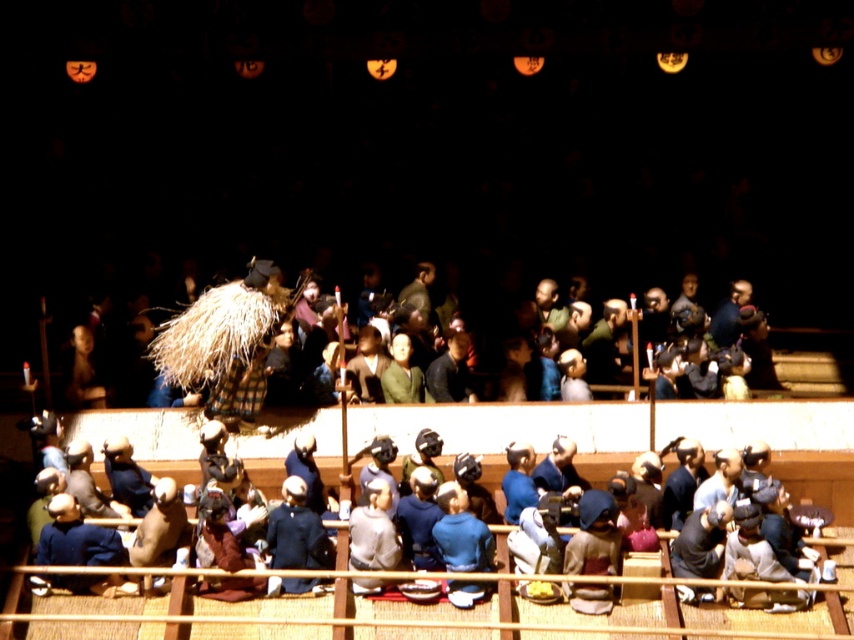
Question: Can you confirm if dark blue fabric at lower right is bigger than green fabric kimono at center?

Choices:
 (A) yes
 (B) no

Answer: (A)

Question: Estimate the real-world distances between objects in this image. Which object is farther from the blue fabric kimono at lower right?

Choices:
 (A) dark brown leather jacket at center
 (B) green fabric kimono at center

Answer: (A)

Question: From the image, what is the correct spatial relationship of blue fabric kimono at lower right in relation to dark brown leather jacket at center?

Choices:
 (A) right
 (B) left

Answer: (A)

Question: Which of the following is the farthest from the observer?

Choices:
 (A) dark brown leather jacket at center
 (B) dark blue fabric at lower right
 (C) blue fabric kimono at lower right
 (D) green fabric kimono at center

Answer: (A)

Question: Estimate the real-world distances between objects in this image. Which object is farther from the dark blue fabric at lower right?

Choices:
 (A) blue fabric kimono at lower left
 (B) green fabric kimono at center
 (C) blue fabric kimono at lower right

Answer: (A)

Question: Is blue fabric kimono at lower right wider than green fabric kimono at center?

Choices:
 (A) no
 (B) yes

Answer: (B)